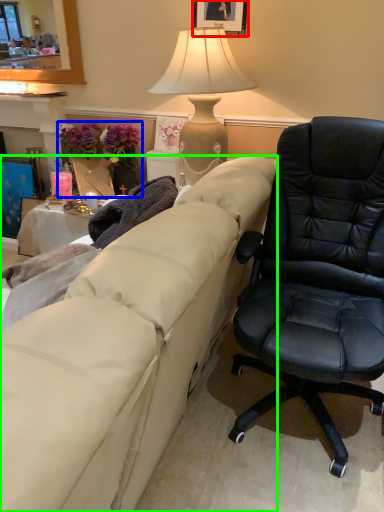
Question: Considering the real-world distances, which object is farthest from picture frame (highlighted by a red box)? houseplant (highlighted by a blue box) or studio couch (highlighted by a green box)?

Choices:
 (A) houseplant
 (B) studio couch

Answer: (B)